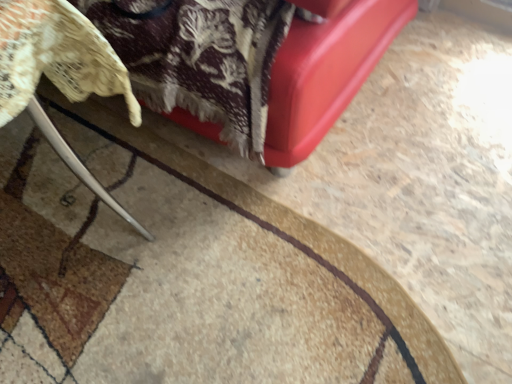
Question: Considering the relative sizes of metallic silver chair at lower left and carpeted mat at lower left in the image provided, is metallic silver chair at lower left smaller than carpeted mat at lower left?

Choices:
 (A) no
 (B) yes

Answer: (A)

Question: From the image's perspective, is metallic silver chair at lower left above carpeted mat at lower left?

Choices:
 (A) yes
 (B) no

Answer: (A)

Question: Would you consider metallic silver chair at lower left to be distant from carpeted mat at lower left?

Choices:
 (A) yes
 (B) no

Answer: (B)

Question: From a real-world perspective, is metallic silver chair at lower left under carpeted mat at lower left?

Choices:
 (A) yes
 (B) no

Answer: (B)

Question: Is carpeted mat at lower left surrounded by metallic silver chair at lower left?

Choices:
 (A) no
 (B) yes

Answer: (A)

Question: Could you tell me if metallic silver chair at lower left is turned towards carpeted mat at lower left?

Choices:
 (A) no
 (B) yes

Answer: (A)

Question: Is there a large distance between carpeted mat at lower left and metallic silver chair at lower left?

Choices:
 (A) no
 (B) yes

Answer: (A)

Question: Is carpeted mat at lower left behind metallic silver chair at lower left?

Choices:
 (A) yes
 (B) no

Answer: (A)

Question: Is carpeted mat at lower left positioned with its back to metallic silver chair at lower left?

Choices:
 (A) yes
 (B) no

Answer: (B)

Question: Is carpeted mat at lower left smaller than metallic silver chair at lower left?

Choices:
 (A) no
 (B) yes

Answer: (B)

Question: Does carpeted mat at lower left appear on the right side of metallic silver chair at lower left?

Choices:
 (A) yes
 (B) no

Answer: (A)

Question: Considering the relative sizes of carpeted mat at lower left and metallic silver chair at lower left in the image provided, is carpeted mat at lower left bigger than metallic silver chair at lower left?

Choices:
 (A) yes
 (B) no

Answer: (B)

Question: From a real-world perspective, is carpeted mat at lower left positioned above or below metallic silver chair at lower left?

Choices:
 (A) above
 (B) below

Answer: (B)